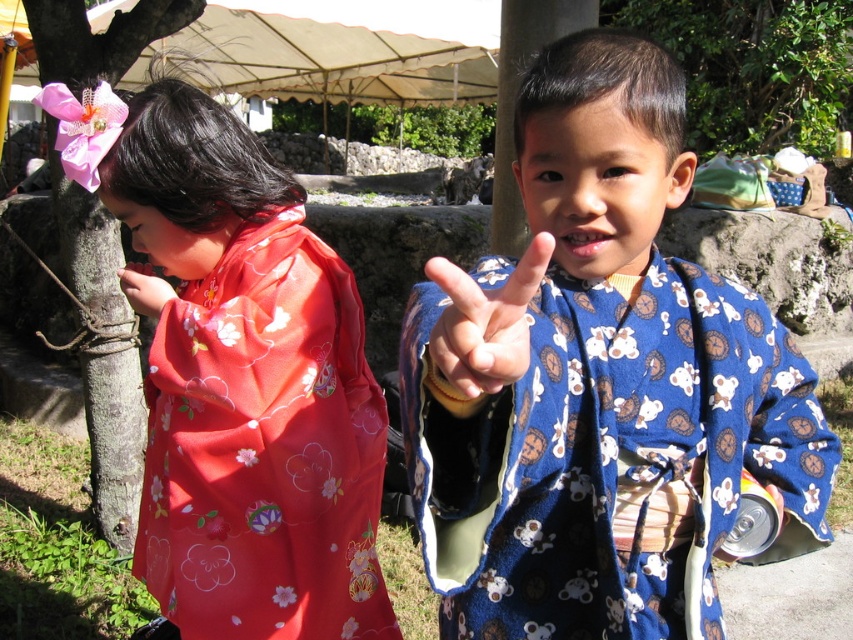
Question: Does matte floral kimono at left appear on the right side of blue fabric hand at center?

Choices:
 (A) yes
 (B) no

Answer: (B)

Question: Which object is farther from the camera taking this photo?

Choices:
 (A) blue printed kimono at center
 (B) blue fabric hand at center
 (C) matte floral kimono at left

Answer: (C)

Question: Can you confirm if blue printed kimono at center is positioned above blue fabric hand at center?

Choices:
 (A) yes
 (B) no

Answer: (B)

Question: Does matte floral kimono at left appear on the right side of blue fabric hand at center?

Choices:
 (A) no
 (B) yes

Answer: (A)

Question: Which point appears closest to the camera in this image?

Choices:
 (A) (340, 531)
 (B) (515, 340)
 (C) (457, 390)

Answer: (B)

Question: Which object is farther from the camera taking this photo?

Choices:
 (A) matte pink kimono at left
 (B) blue printed kimono at center
 (C) matte floral kimono at left

Answer: (A)